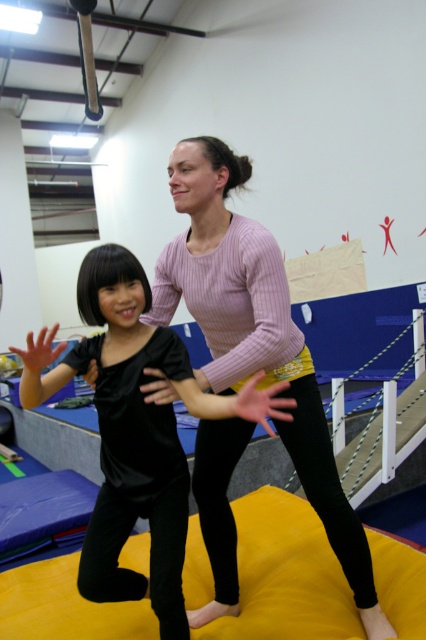
You are a photographer standing at the camera position. You want to take a closeup shot of the pink ribbed sweater at center. Considering the distance, can you get a clear focus on the sweater without moving the camera?

The pink ribbed sweater at center is 4.74 feet away from camera, so yes, you can get a clear focus on the sweater without moving the camera as it is within a typical focusing range for most cameras.

You are a photographer setting up a shoot in the studio. You want to ensure both the pink ribbed sweater at center and the black velvet shirt at center are visible in the frame. Based on their positions, which clothing item should you focus on first to ensure both are in focus?

The black velvet shirt at center is behind the pink ribbed sweater at center. To ensure both are in focus, you should focus on the black velvet shirt at center first, as it is farther away, and the depth of field will naturally include the closer pink ribbed sweater at center.

You are a photographer setting up for a photoshoot in the studio. You need to place a spotlight on the pink ribbed sweater at center and the black velvet shirt at center. Which one should you place the spotlight to the right of?

The pink ribbed sweater at center should be placed to the right of the black velvet shirt at center because the pink ribbed sweater at center is positioned on the right side of black velvet shirt at center.